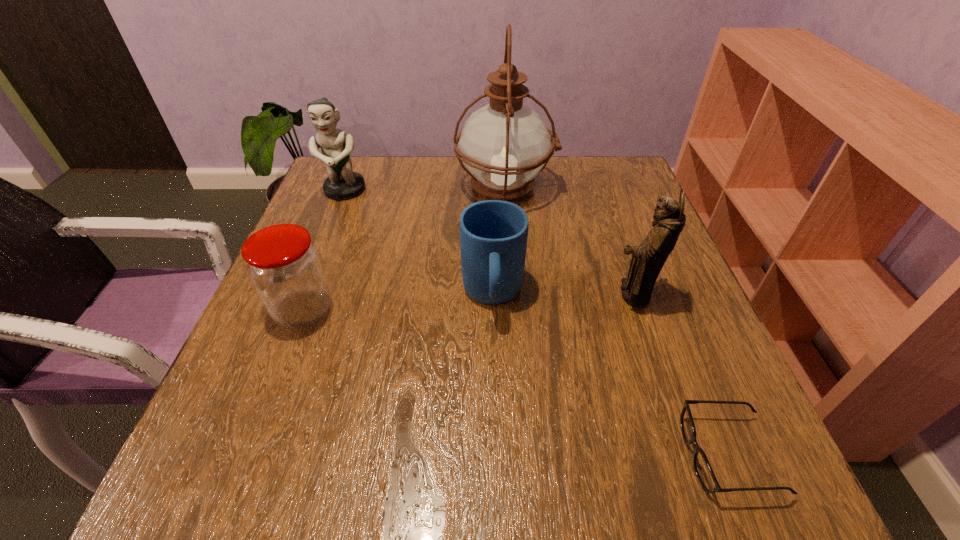
Identify the location of oil lamp. click(x=504, y=145).

This screenshot has width=960, height=540. Find the location of `the nearer figurine`. the nearer figurine is located at coordinates (648, 259).

The width and height of the screenshot is (960, 540). Identify the location of the farther figurine. (342, 184).

Locate an element on the screen. This screenshot has height=540, width=960. jar is located at coordinates (284, 266).

This screenshot has height=540, width=960. I want to click on mug, so click(x=493, y=233).

The image size is (960, 540). Identify the location of the shortest object. (702, 468).

This screenshot has width=960, height=540. What are the coordinates of `the nearest object` in the screenshot? It's located at (702, 468).

This screenshot has height=540, width=960. Find the location of `vacant space situated on the front of the oil lamp`. vacant space situated on the front of the oil lamp is located at coordinates point(516,338).

At what (x,y) coordinates should I click in order to perform the action: click on vacant region located 0.110m on the front-facing side of the nearer figurine. Please return your answer as a coordinate pair (x, y). Looking at the image, I should click on (551, 294).

Locate an element on the screen. This screenshot has height=540, width=960. free space located 0.150m on the front-facing side of the nearer figurine is located at coordinates (530, 294).